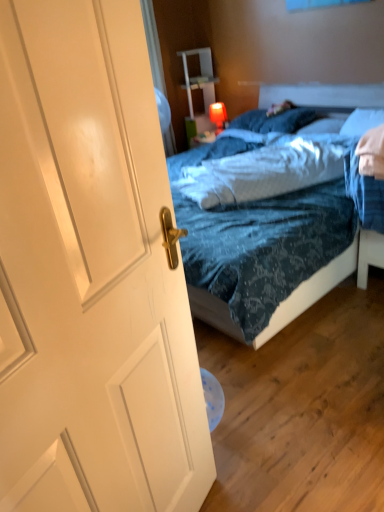
The image size is (384, 512). Describe the element at coordinates (322, 126) in the screenshot. I see `white soft pillow at upper center, which appears as the 2th pillow when viewed from the right` at that location.

The width and height of the screenshot is (384, 512). Describe the element at coordinates (266, 170) in the screenshot. I see `blue textured bedsheet at center` at that location.

Based on the photo, measure the distance between point (244,158) and camera.

A distance of 8.01 feet exists between point (244,158) and camera.

The image size is (384, 512). I want to click on white matte door at left, so click(90, 274).

Image resolution: width=384 pixels, height=512 pixels. I want to click on white soft pillow at upper right, acting as the 1th pillow starting from the right, so click(x=362, y=122).

Where is `white soft pillow at upper center, the second pillow positioned from the left`? The height and width of the screenshot is (512, 384). white soft pillow at upper center, the second pillow positioned from the left is located at coordinates point(322,126).

Can we say white soft pillow at upper center, the second pillow positioned from the left, lies outside blue textured pillow at center, the 1th pillow in the left-to-right sequence?

Yes, white soft pillow at upper center, the second pillow positioned from the left, is located beyond the bounds of blue textured pillow at center, the 1th pillow in the left-to-right sequence.

Considering the sizes of objects white soft pillow at upper center, the second pillow positioned from the left, and blue textured pillow at center, the 1th pillow in the left-to-right sequence, in the image provided, who is smaller, white soft pillow at upper center, the second pillow positioned from the left, or blue textured pillow at center, the 1th pillow in the left-to-right sequence,?

white soft pillow at upper center, the second pillow positioned from the left.

Can you tell me how much white soft pillow at upper center, the second pillow positioned from the left, and blue textured pillow at center, the 1th pillow in the left-to-right sequence, differ in facing direction?

The angular difference between white soft pillow at upper center, the second pillow positioned from the left, and blue textured pillow at center, the 1th pillow in the left-to-right sequence, is 0.00013 degrees.

Between blue textured pillow at center, the 1th pillow in the left-to-right sequence, and white matte door at left, which one has smaller width?

white matte door at left.

At what (x,y) coordinates should I click in order to perform the action: click on door above the blue textured pillow at center, which ranks as the third pillow in right-to-left order (from a real-world perspective). Please return your answer as a coordinate pair (x, y). Looking at the image, I should click on (90, 274).

From the image's perspective, is blue textured pillow at center, the 1th pillow in the left-to-right sequence, under white matte door at left?

Actually, blue textured pillow at center, the 1th pillow in the left-to-right sequence, appears above white matte door at left in the image.

In the image, is blue textured bedsheet at center positioned in front of or behind blue textured pillow at center, which ranks as the third pillow in right-to-left order?

blue textured bedsheet at center is positioned closer to the viewer than blue textured pillow at center, which ranks as the third pillow in right-to-left order.

Looking at this image, in terms of size, does blue textured bedsheet at center appear bigger or smaller than blue textured pillow at center, which ranks as the third pillow in right-to-left order?

In the image, blue textured bedsheet at center appears to be larger than blue textured pillow at center, which ranks as the third pillow in right-to-left order.

From the image's perspective, who appears lower, blue textured bedsheet at center or blue textured pillow at center, the 1th pillow in the left-to-right sequence?

blue textured bedsheet at center, from the image's perspective.

Between blue textured bedsheet at center and blue textured pillow at center, which ranks as the third pillow in right-to-left order, which one has less height?

With less height is blue textured pillow at center, which ranks as the third pillow in right-to-left order.

From a real-world perspective, is white matte door at left above or below white soft pillow at upper right, which is counted as the 3th pillow, starting from the left?

white matte door at left is situated higher than white soft pillow at upper right, which is counted as the 3th pillow, starting from the left, in the real world.

In the scene shown: How far apart are white matte door at left and white soft pillow at upper right, acting as the 1th pillow starting from the right?

6.57 feet.

Looking at this image, is white soft pillow at upper right, which is counted as the 3th pillow, starting from the left, located within white matte door at left?

No, white soft pillow at upper right, which is counted as the 3th pillow, starting from the left, is located outside of white matte door at left.

Can you tell me how much white matte door at left and white soft pillow at upper right, acting as the 1th pillow starting from the right, differ in facing direction?

The angular difference between white matte door at left and white soft pillow at upper right, acting as the 1th pillow starting from the right, is 105 degrees.

Is blue textured bedsheet at center taller than white soft pillow at upper right, acting as the 1th pillow starting from the right?

No, blue textured bedsheet at center is not taller than white soft pillow at upper right, acting as the 1th pillow starting from the right.

Does point (274, 141) come behind point (379, 123)?

Yes, it is.

Considering the relative positions of blue textured bedsheet at center and white soft pillow at upper right, acting as the 1th pillow starting from the right, in the image provided, is blue textured bedsheet at center in front of white soft pillow at upper right, acting as the 1th pillow starting from the right,?

Yes, blue textured bedsheet at center is in front of white soft pillow at upper right, acting as the 1th pillow starting from the right.

Could you tell me if blue textured bedsheet at center is turned towards white soft pillow at upper center, the second pillow positioned from the left?

No, blue textured bedsheet at center is not facing towards white soft pillow at upper center, the second pillow positioned from the left.

Can we say blue textured bedsheet at center lies outside white soft pillow at upper center, the second pillow positioned from the left?

Absolutely, blue textured bedsheet at center is external to white soft pillow at upper center, the second pillow positioned from the left.

Based on their sizes in the image, would you say blue textured bedsheet at center is bigger or smaller than white soft pillow at upper center, the second pillow positioned from the left?

blue textured bedsheet at center is bigger than white soft pillow at upper center, the second pillow positioned from the left.

From a real-world perspective, is blue textured bedsheet at center on white soft pillow at upper center, which appears as the 2th pillow when viewed from the right?

Yes, from a real-world perspective, blue textured bedsheet at center is above white soft pillow at upper center, which appears as the 2th pillow when viewed from the right.

What's the angular difference between blue textured bedsheet at center and white matte door at left's facing directions?

134 degrees.

Measure the distance from blue textured bedsheet at center to white matte door at left.

The distance of blue textured bedsheet at center from white matte door at left is 1.43 meters.

In the scene shown: Considering the relative sizes of blue textured bedsheet at center and white matte door at left in the image provided, is blue textured bedsheet at center wider than white matte door at left?

Yes.

Based on the photo, do you think blue textured bedsheet at center is within white matte door at left, or outside of it?

blue textured bedsheet at center is not enclosed by white matte door at left.

In order to click on pillow below the blue textured pillow at center, the 1th pillow in the left-to-right sequence (from a real-world perspective) in this screenshot , I will do `click(322, 126)`.

Find the location of a particular element. the 1st pillow to the right when counting from the white matte door at left is located at coordinates (274, 120).

Considering their positions, is blue textured pillow at center, the 1th pillow in the left-to-right sequence, positioned closer to blue textured bedsheet at center than white matte door at left?

blue textured pillow at center, the 1th pillow in the left-to-right sequence, lies closer to blue textured bedsheet at center than the other object.

Based on their spatial positions, is blue textured bedsheet at center or white soft pillow at upper right, which is counted as the 3th pillow, starting from the left, closer to white soft pillow at upper center, the second pillow positioned from the left?

white soft pillow at upper right, which is counted as the 3th pillow, starting from the left, lies closer to white soft pillow at upper center, the second pillow positioned from the left, than the other object.

Which object lies further to the anchor point white soft pillow at upper right, acting as the 1th pillow starting from the right, white soft pillow at upper center, the second pillow positioned from the left, or blue textured bedsheet at center?

blue textured bedsheet at center lies further to white soft pillow at upper right, acting as the 1th pillow starting from the right, than the other object.

Which object lies further to the anchor point blue textured bedsheet at center, blue textured pillow at center, the 1th pillow in the left-to-right sequence, or white soft pillow at upper right, acting as the 1th pillow starting from the right?

blue textured pillow at center, the 1th pillow in the left-to-right sequence, lies further to blue textured bedsheet at center than the other object.

Estimate the real-world distances between objects in this image. Which object is further from white soft pillow at upper center, which appears as the 2th pillow when viewed from the right, white soft pillow at upper right, acting as the 1th pillow starting from the right, or white matte door at left?

white matte door at left is positioned further to the anchor white soft pillow at upper center, which appears as the 2th pillow when viewed from the right.

From the image, which object appears to be farther from white soft pillow at upper center, which appears as the 2th pillow when viewed from the right, blue textured bedsheet at center or blue textured pillow at center, the 1th pillow in the left-to-right sequence?

The object further to white soft pillow at upper center, which appears as the 2th pillow when viewed from the right, is blue textured bedsheet at center.

Which object lies further to the anchor point white matte door at left, white soft pillow at upper center, which appears as the 2th pillow when viewed from the right, or white soft pillow at upper right, acting as the 1th pillow starting from the right?

Among the two, white soft pillow at upper center, which appears as the 2th pillow when viewed from the right, is located further to white matte door at left.

Considering their positions, is white soft pillow at upper center, the second pillow positioned from the left, positioned further to white matte door at left than blue textured pillow at center, the 1th pillow in the left-to-right sequence?

blue textured pillow at center, the 1th pillow in the left-to-right sequence, is positioned further to the anchor white matte door at left.

This screenshot has height=512, width=384. I want to click on pillow between white matte door at left and white soft pillow at upper center, the second pillow positioned from the left, from front to back, so click(362, 122).

You are a GUI agent. You are given a task and a screenshot of the screen. Output one action in this format:
    pyautogui.click(x=<x>, y=<y>)
    Task: Click on the sheet between white matte door at left and white soft pillow at upper right, which is counted as the 3th pillow, starting from the left, from front to back
    The height and width of the screenshot is (512, 384).
    Given the screenshot: What is the action you would take?
    pyautogui.click(x=266, y=170)

In order to click on pillow situated between blue textured pillow at center, which ranks as the third pillow in right-to-left order, and white soft pillow at upper right, which is counted as the 3th pillow, starting from the left, from left to right in this screenshot , I will do `click(322, 126)`.

You are a GUI agent. You are given a task and a screenshot of the screen. Output one action in this format:
    pyautogui.click(x=<x>, y=<y>)
    Task: Click on the sheet positioned between white matte door at left and white soft pillow at upper center, the second pillow positioned from the left, from near to far
    Image resolution: width=384 pixels, height=512 pixels.
    Given the screenshot: What is the action you would take?
    pyautogui.click(x=266, y=170)